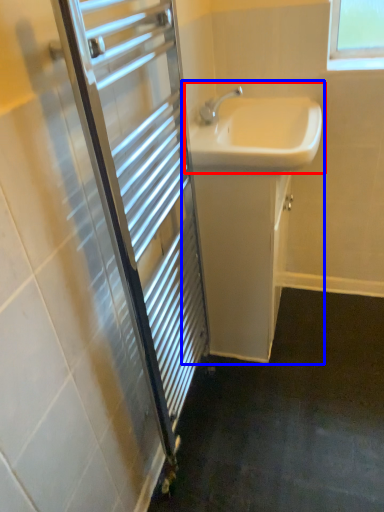
Question: Among these objects, which one is farthest to the camera, sink (highlighted by a red box) or bathroom cabinet (highlighted by a blue box)?

Choices:
 (A) sink
 (B) bathroom cabinet

Answer: (B)